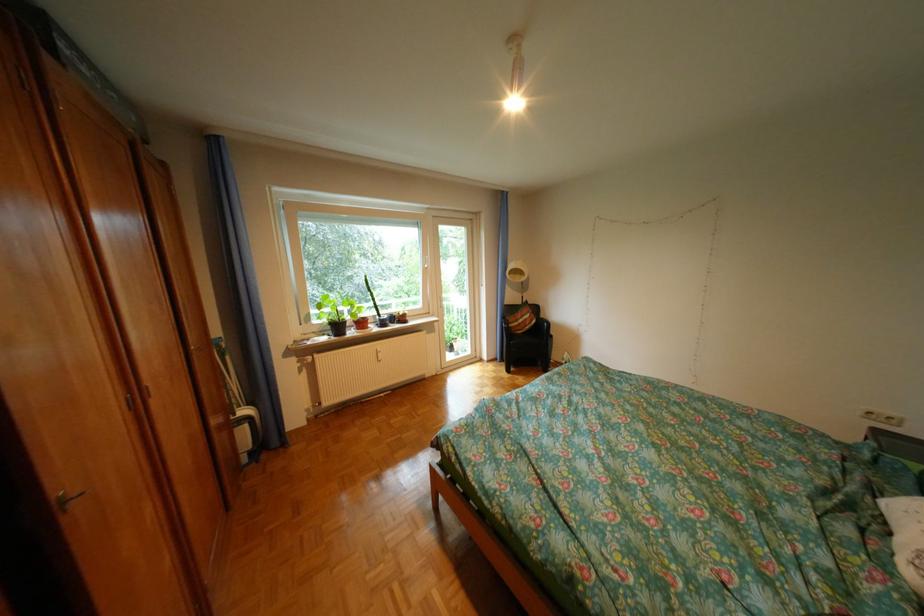
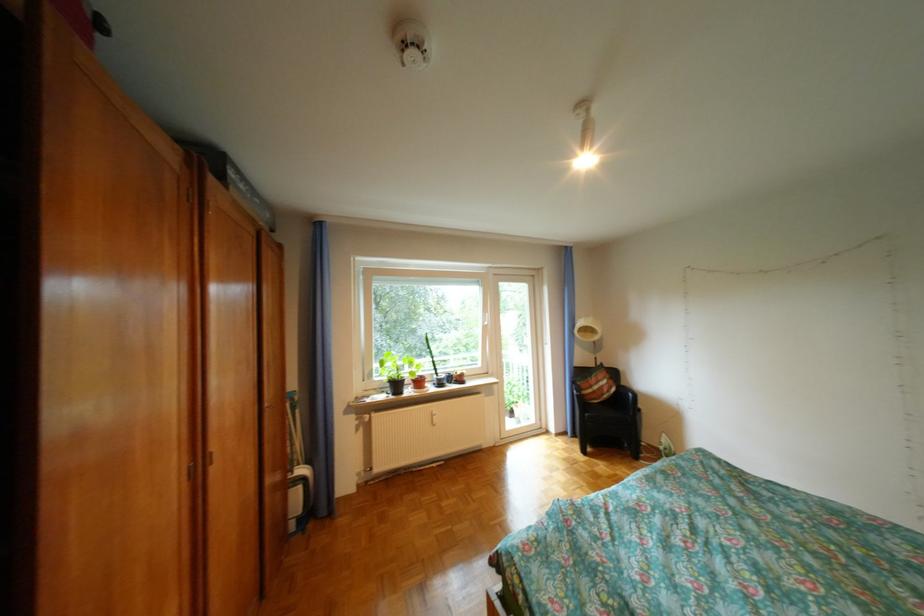
Where in the second image is the point corresponding to the point at 541,345 from the first image?

(621, 419)